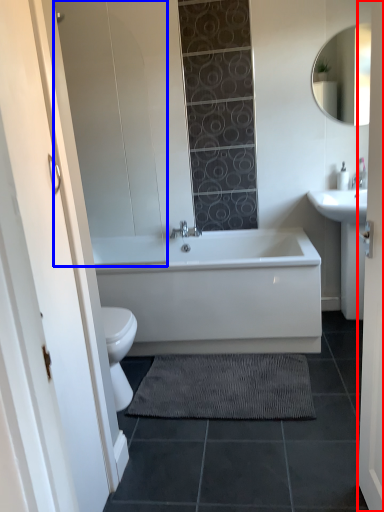
Question: Which point is closer to the camera, door (highlighted by a red box) or glass door (highlighted by a blue box)?

Choices:
 (A) door
 (B) glass door

Answer: (A)